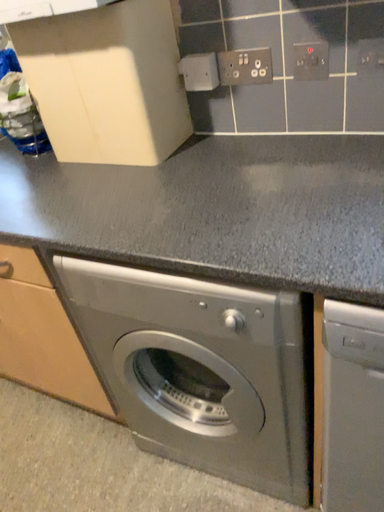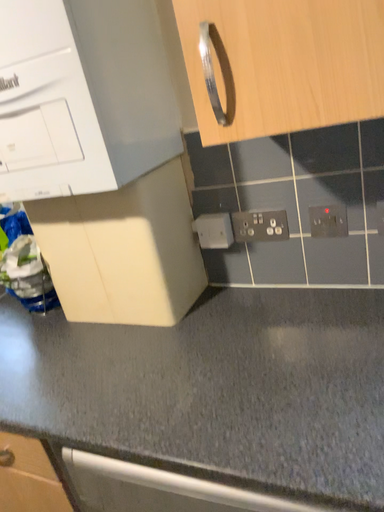
Question: Which way did the camera rotate in the video?

Choices:
 (A) rotated downward
 (B) rotated upward

Answer: (B)